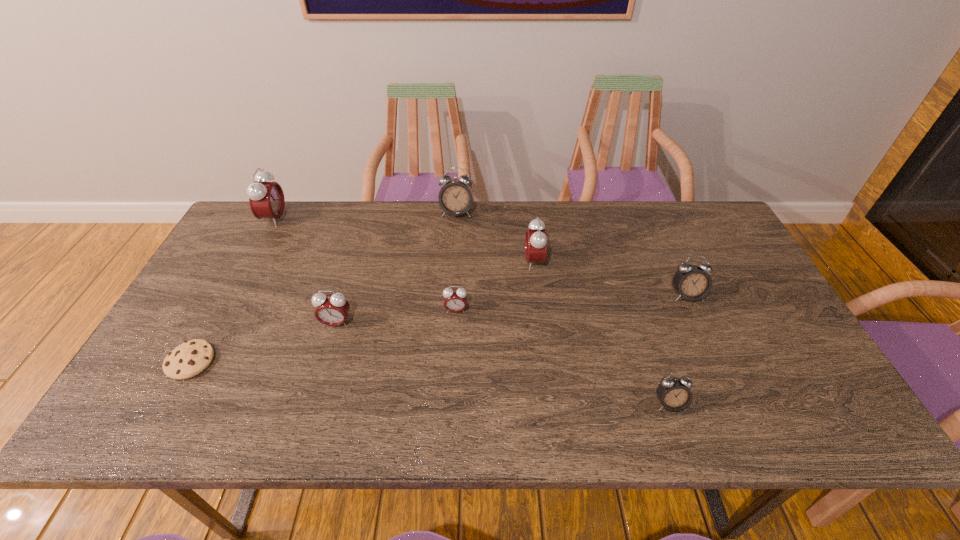
You are a GUI agent. You are given a task and a screenshot of the screen. Output one action in this format:
    pyautogui.click(x=<x>, y=<y>)
    Task: Click on the free space located 0.360m on the clock face of the rightmost pink alarm clock
    
    Given the screenshot: What is the action you would take?
    pyautogui.click(x=404, y=262)

I want to click on vacant space located 0.060m on the clock face of the second smallest pink alarm clock, so click(329, 349).

Locate an element on the screen. vacant region located 0.180m on the face of the fourth farthest alarm clock is located at coordinates (716, 361).

At what (x,y) coordinates should I click in order to perform the action: click on free space located 0.250m on the clock face of the fourth nearest object. Please return your answer as a coordinate pair (x, y). Looking at the image, I should click on coord(451,400).

Identify the location of blank space located 0.250m on the right of the brown cookie. (318, 361).

At what (x,y) coordinates should I click in order to perform the action: click on object that is at the near edge. Please return your answer as a coordinate pair (x, y). The height and width of the screenshot is (540, 960). Looking at the image, I should click on (674, 394).

Identify the location of alarm clock that is at the left edge. (266, 199).

What are the coordinates of `cookie present at the left edge` in the screenshot? It's located at (192, 357).

The width and height of the screenshot is (960, 540). What are the coordinates of `object present at the far left corner` in the screenshot? It's located at pyautogui.click(x=266, y=199).

Image resolution: width=960 pixels, height=540 pixels. In the image, there is a desktop. Find the location of `vacant space at the far edge`. vacant space at the far edge is located at coordinates (605, 213).